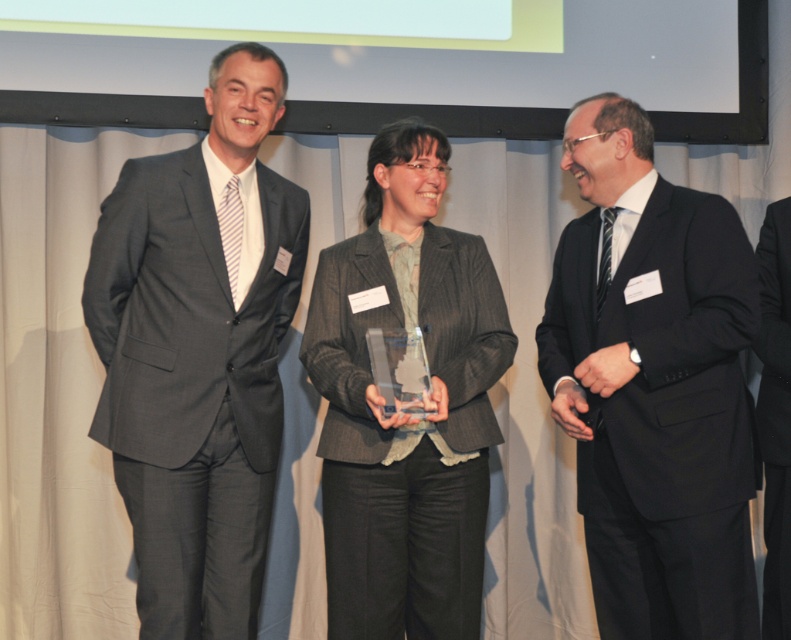
You are standing at the center of the image and want to hand a document to the person in the matte black suit at right. Which direction should you move to reach them?

The matte black suit at right is located at point 0.603 on the x axis and 0.827 on the y axis. Since you are at the center, moving towards the right and slightly upwards would reach them.